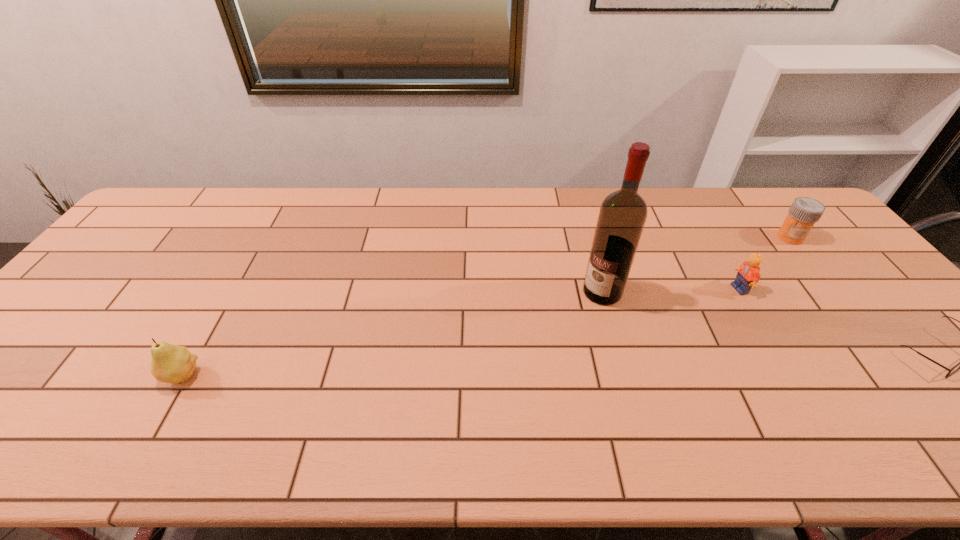
Locate an element on the screen. This screenshot has height=540, width=960. free spot on the desktop that is between the pear and the spectacles and is positioned on the front-facing side of the Lego is located at coordinates pyautogui.click(x=628, y=361).

Identify the location of free space on the desktop that is between the leftmost object and the spectacles and is positioned on the label side of the medicine. This screenshot has height=540, width=960. (669, 360).

The width and height of the screenshot is (960, 540). What are the coordinates of `vacant space on the desktop that is between the leftmost object and the spectacles and is positioned on the front and back of the alcohol` in the screenshot? It's located at (523, 365).